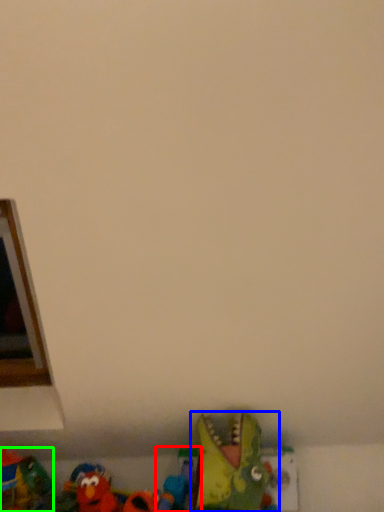
Question: Considering the real-world distances, which object is closest to toy (highlighted by a red box)? toy (highlighted by a blue box) or toy (highlighted by a green box).

Choices:
 (A) toy
 (B) toy

Answer: (A)